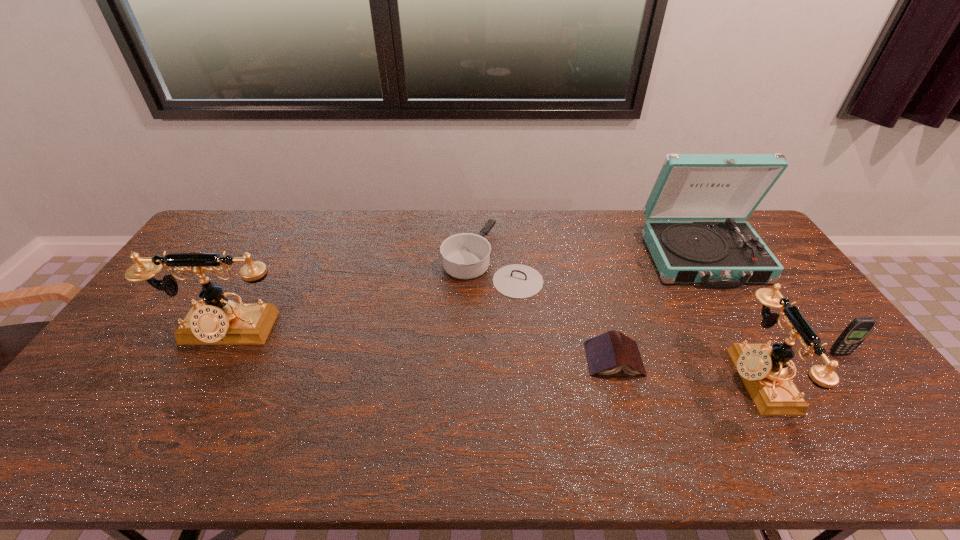
Where is `empty space that is in between the leftmost object and the saucepan`? The image size is (960, 540). empty space that is in between the leftmost object and the saucepan is located at coordinates (358, 296).

Where is `free space between the second shortest object and the book`? The image size is (960, 540). free space between the second shortest object and the book is located at coordinates coord(552,310).

Identify the location of vacant area that lies between the book and the tallest object. Image resolution: width=960 pixels, height=540 pixels. tap(659, 308).

Find the location of a particular element. The width and height of the screenshot is (960, 540). free spot between the fifth shortest object and the tallest object is located at coordinates (464, 294).

The width and height of the screenshot is (960, 540). What are the coordinates of `free space between the shortest object and the left telephone` in the screenshot? It's located at (420, 345).

What are the coordinates of `free space between the third tallest object and the book` in the screenshot? It's located at (685, 369).

Image resolution: width=960 pixels, height=540 pixels. I want to click on free space between the tallest object and the fifth object from right to left, so click(x=596, y=259).

Find the location of `vacant area between the shorter telephone and the record player`. vacant area between the shorter telephone and the record player is located at coordinates (730, 318).

Find the location of a particular element. The width and height of the screenshot is (960, 540). vacant area between the fourth tallest object and the shorter telephone is located at coordinates (798, 366).

The image size is (960, 540). I want to click on the fourth closest object to the saucepan, so pos(763,369).